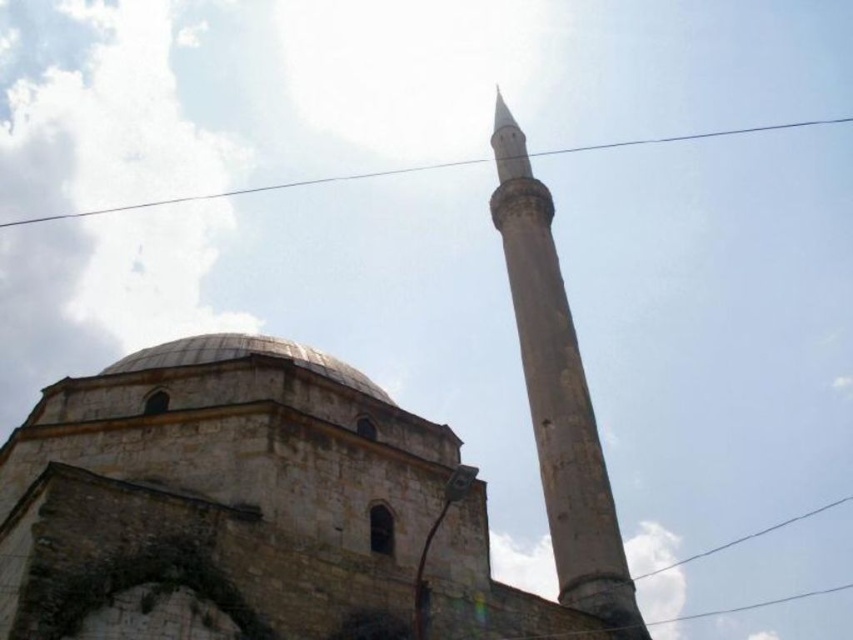
Is smooth stone minaret at center in front of gray stone dome at center?

That is False.

Which is above, smooth stone minaret at center or gray stone dome at center?

smooth stone minaret at center is above.

Between point (560, 384) and point (349, 369), which one is positioned in front?

Point (349, 369)

At what (x,y) coordinates should I click in order to perform the action: click on smooth stone minaret at center. Please return your answer as a coordinate pair (x, y). The image size is (853, 640). Looking at the image, I should click on (558, 396).

Can you confirm if smooth stone minaret at center is taller than clear wire at upper center?

Indeed, smooth stone minaret at center has a greater height compared to clear wire at upper center.

Can you confirm if smooth stone minaret at center is positioned below clear wire at upper center?

Indeed, smooth stone minaret at center is positioned under clear wire at upper center.

Where is `smooth stone minaret at center`? smooth stone minaret at center is located at coordinates (558, 396).

Does gray stone dome at center have a smaller size compared to clear wire at upper center?

Yes, gray stone dome at center is smaller than clear wire at upper center.

Where is `gray stone dome at center`? This screenshot has width=853, height=640. gray stone dome at center is located at coordinates (242, 356).